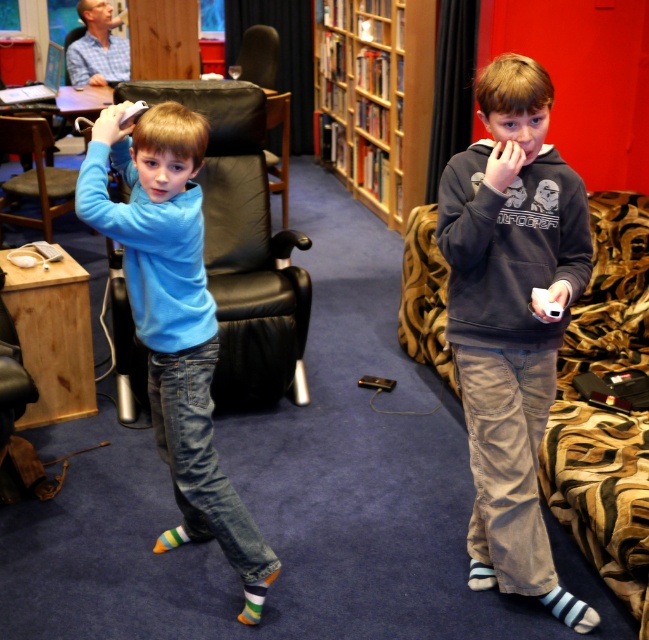
You are trying to decide which item to move first. Based on their sizes, which is easier to move, the dark gray hoodie at center or the black leather chair at left?

The dark gray hoodie at center is thinner than the black leather chair at left, so it is easier to move the dark gray hoodie at center first.

You are a delivery person who needs to place a large package on the floor between the dark gray hoodie at center and the black leather chair at left. Considering their sizes, will the package fit without touching either object?

The dark gray hoodie at center is larger than the black leather chair at left. Since the package is large, there might not be enough space between them to place it without touching either object.